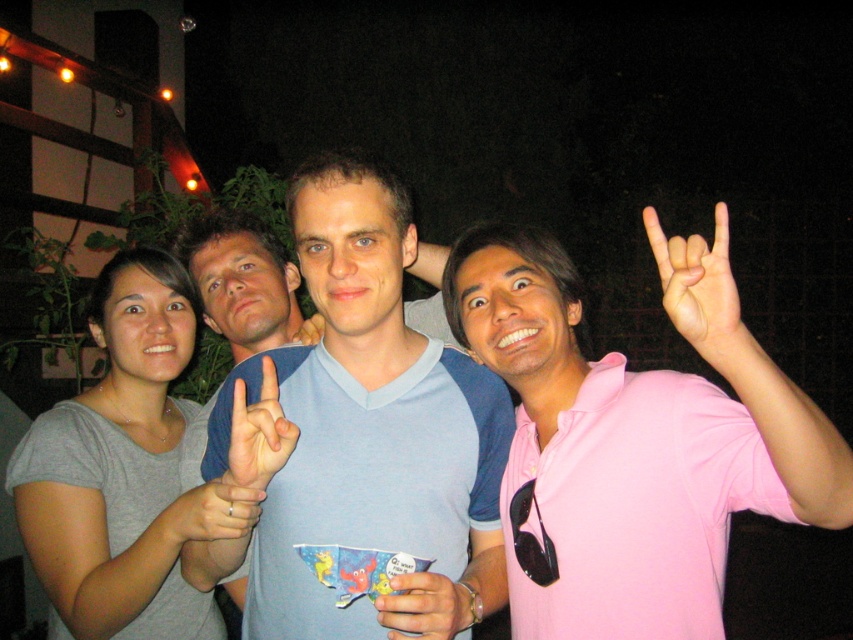
You are organizing a group photo and need to arrange the gray cotton shirt at left and the white matte hand at center so that both fit within a 1.2 meter wide frame. Given their widths, will they fit together in the frame?

The gray cotton shirt at left is wider than the white matte hand at center. Together, their combined widths would exceed the 1.2 meter frame since the gray cotton shirt at left alone is already wider than the white matte hand at center. However, without exact measurements, we can only confirm that the total width would be greater than double the hand width, which might not fit. Please adjust their positions for a better fit.

You are taking a photo of the group and want to ensure that both the gray cotton shirt at left and the matte pink hand at upper right are clearly visible. Based on their positions, which object should you focus on first to ensure both are in frame?

The gray cotton shirt at left is located below the matte pink hand at upper right, so focusing on the matte pink hand at upper right first will help ensure both are in frame since it is positioned higher up.